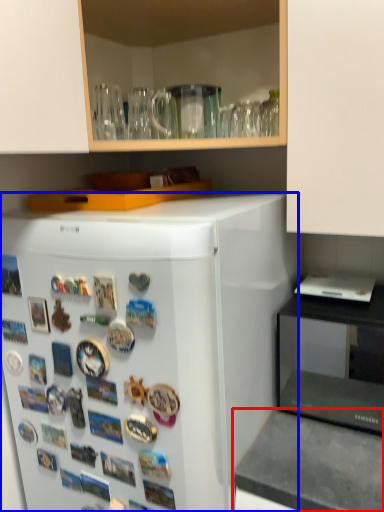
Question: Among these objects, which one is farthest to the camera, counter top (highlighted by a red box) or refrigerator (highlighted by a blue box)?

Choices:
 (A) counter top
 (B) refrigerator

Answer: (A)